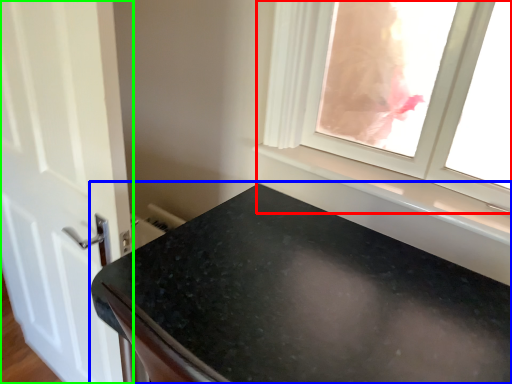
Question: Considering the real-world distances, which object is farthest from window (highlighted by a red box)? countertop (highlighted by a blue box) or door (highlighted by a green box)?

Choices:
 (A) countertop
 (B) door

Answer: (B)